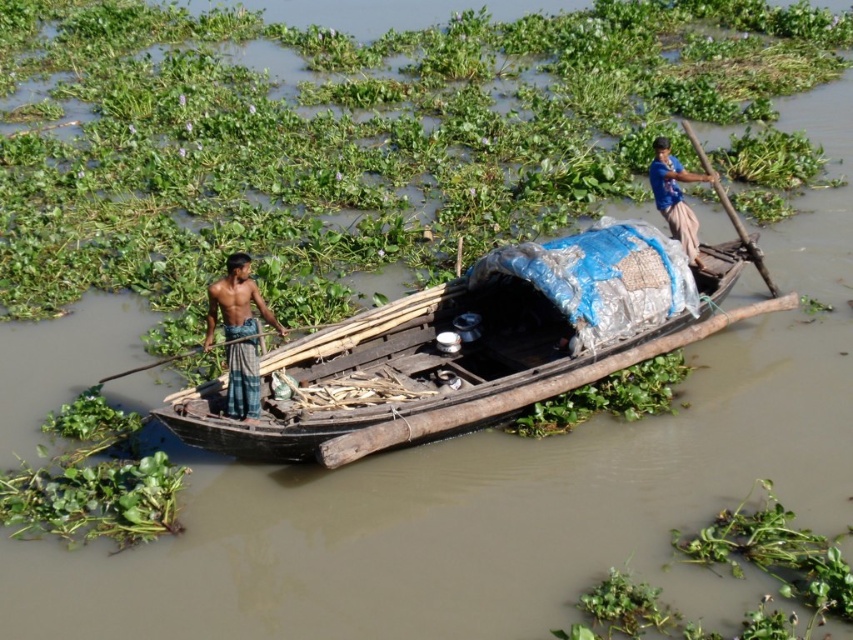
Who is more forward, (386, 321) or (183, 353)?

Point (386, 321)

Is wooden boat at center above wooden paddle at left?

No.

Is point (537, 356) less distant than point (328, 324)?

That is True.

Find the location of a particular element. wooden boat at center is located at coordinates (463, 344).

Who is more distant from viewer, (233, 307) or (677, 204)?

The point (677, 204) is more distant.

Is shiny blue shirt at left behind blue fabric at upper right?

That is False.

Is point (254, 355) positioned before point (665, 220)?

Yes, point (254, 355) is in front of point (665, 220).

You are a GUI agent. You are given a task and a screenshot of the screen. Output one action in this format:
    pyautogui.click(x=<x>, y=<y>)
    Task: Click on the shiny blue shirt at left
    
    Given the screenshot: What is the action you would take?
    pyautogui.click(x=236, y=301)

Does wooden boat at center have a smaller size compared to blue fabric at upper right?

No.

From the picture: Does wooden boat at center appear on the right side of blue fabric at upper right?

Incorrect, wooden boat at center is not on the right side of blue fabric at upper right.

Where is `wooden boat at center`? wooden boat at center is located at coordinates (463, 344).